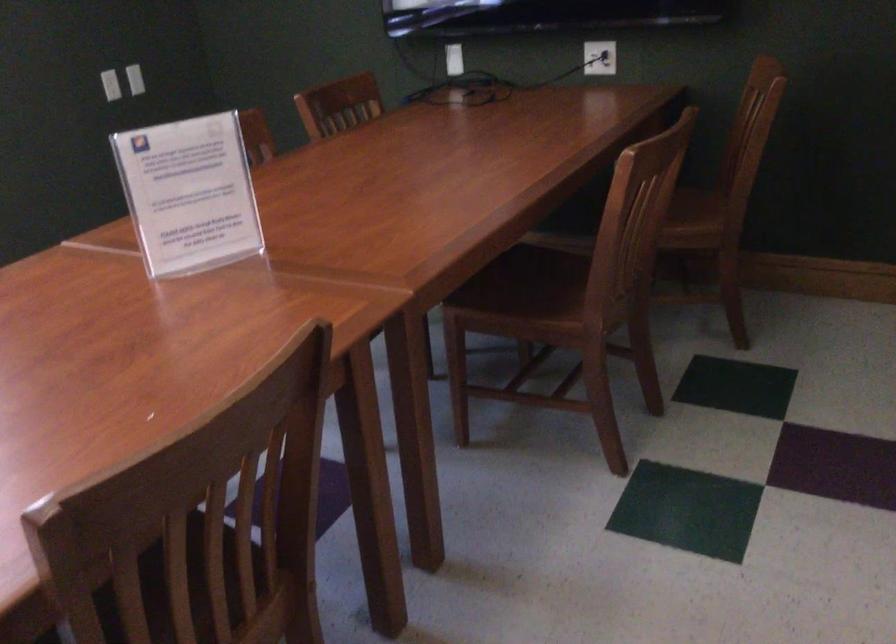
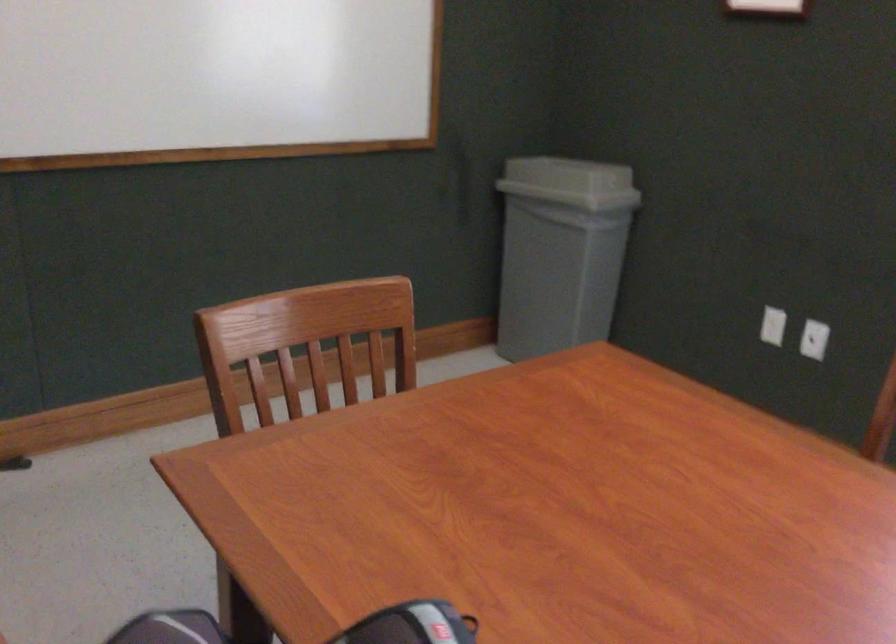
The first image is from the beginning of the video and the second image is from the end. How did the camera likely rotate when shooting the video?

The camera rotated toward left-down.